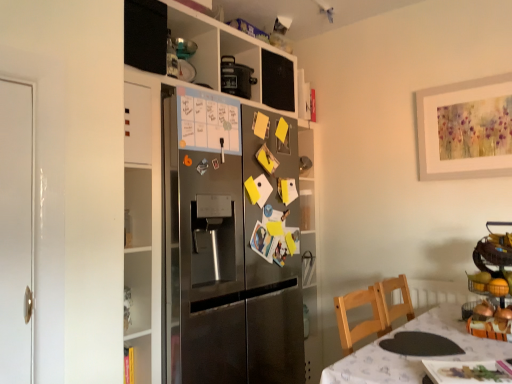
Question: Does point (175, 11) appear closer or farther from the camera than point (473, 324)?

Choices:
 (A) farther
 (B) closer

Answer: (A)

Question: In terms of size, does stainless steel refrigerator at center appear bigger or smaller than metallic fruit basket at right?

Choices:
 (A) big
 (B) small

Answer: (A)

Question: Considering the real-world distances, which object is closest to the metallic fruit basket at right?

Choices:
 (A) white fabric table at lower right
 (B) stainless steel refrigerator at center
 (C) orange matte fruit basket at right

Answer: (C)

Question: Estimate the real-world distances between objects in this image. Which object is farther from the metallic fruit basket at right?

Choices:
 (A) stainless steel refrigerator at center
 (B) white fabric table at lower right
 (C) orange matte fruit basket at right

Answer: (A)